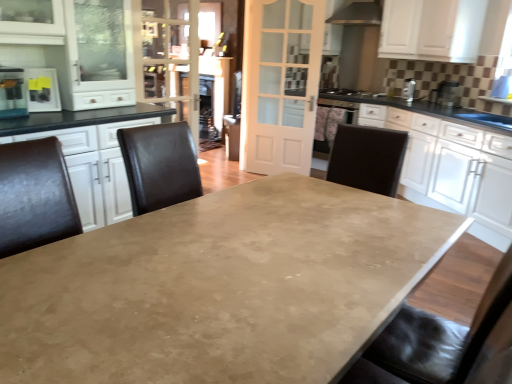
Question: From a real-world perspective, is black matte gas stove at upper right beneath clear glass door at upper center?

Choices:
 (A) no
 (B) yes

Answer: (B)

Question: Considering the relative positions of black matte gas stove at upper right and clear glass door at upper center in the image provided, is black matte gas stove at upper right to the left of clear glass door at upper center from the viewer's perspective?

Choices:
 (A) yes
 (B) no

Answer: (B)

Question: Can you confirm if black matte gas stove at upper right is shorter than clear glass door at upper center?

Choices:
 (A) no
 (B) yes

Answer: (B)

Question: Does black matte gas stove at upper right lie in front of clear glass door at upper center?

Choices:
 (A) yes
 (B) no

Answer: (B)

Question: Does black matte gas stove at upper right contain clear glass door at upper center?

Choices:
 (A) yes
 (B) no

Answer: (B)

Question: From their relative heights in the image, would you say metallic stainless steel at upper center is taller or shorter than clear glass door at upper center?

Choices:
 (A) tall
 (B) short

Answer: (B)

Question: Is point (342, 21) positioned closer to the camera than point (183, 52)?

Choices:
 (A) closer
 (B) farther

Answer: (B)

Question: Considering their positions, is metallic stainless steel at upper center located in front of or behind clear glass door at upper center?

Choices:
 (A) front
 (B) behind

Answer: (B)

Question: Is metallic stainless steel at upper center bigger or smaller than clear glass door at upper center?

Choices:
 (A) small
 (B) big

Answer: (B)

Question: Is white glossy cabinet at right, which appears as the 1th cabinetry when ordered from the bottom, taller or shorter than metallic silver toaster at upper right, which is the third appliance from bottom to top?

Choices:
 (A) tall
 (B) short

Answer: (A)

Question: Visually, is white glossy cabinet at right, marked as the second cabinetry in a top-to-bottom arrangement, positioned to the left or to the right of metallic silver toaster at upper right, arranged as the 2th appliance when viewed from the right?

Choices:
 (A) left
 (B) right

Answer: (B)

Question: From a real-world perspective, relative to metallic silver toaster at upper right, which appears as the third appliance when viewed from the front, is white glossy cabinet at right, which appears as the 1th cabinetry when ordered from the bottom, vertically above or below?

Choices:
 (A) below
 (B) above

Answer: (A)

Question: Relative to metallic silver toaster at upper right, arranged as the 2th appliance when viewed from the right, is white glossy cabinet at right, marked as the second cabinetry in a top-to-bottom arrangement, in front or behind?

Choices:
 (A) behind
 (B) front

Answer: (B)

Question: From their relative heights in the image, would you say white glossy cabinet at right, which appears as the 1th cabinetry when ordered from the bottom, is taller or shorter than black leather chairs at left?

Choices:
 (A) tall
 (B) short

Answer: (B)

Question: Considering the positions of point [x=431, y=160] and point [x=118, y=182], is point [x=431, y=160] closer or farther from the camera than point [x=118, y=182]?

Choices:
 (A) farther
 (B) closer

Answer: (A)